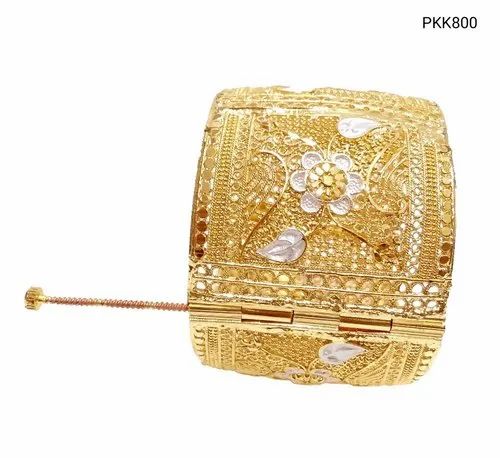
I want to click on hinge, so click(x=276, y=319), click(x=360, y=323).